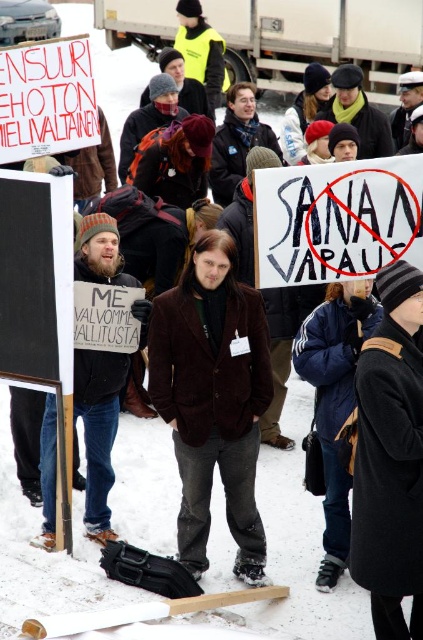
You are a photographer at the protest. You want to take a photo of the bearded man with sign at center and the black paper sign at center. Which object is taller so that it can be seen clearly in the photo?

The bearded man with sign at center is taller than the black paper sign at center, so the bearded man with sign at center will be seen clearly in the photo.

You are a photographer trying to capture a clear photo of the bearded man with sign at center. However, the black paper sign at center is blocking your view. Can you adjust your position to avoid the obstruction?

The black paper sign at center is positioned over the bearded man with sign at center, so moving your camera angle slightly downward or to the side should allow you to capture the bearded man with sign at center without the obstruction.

You are a photographer at the protest scene. You want to capture a photo that includes both the black paper sign at center and the bearded man with sign at center. Which object should you focus on first to ensure both are in frame?

The black paper sign at center has a smaller size compared to bearded man with sign at center. To ensure both are in frame, focus on the bearded man with sign at center first since it is larger and easier to locate, then adjust to include the smaller black paper sign at center.